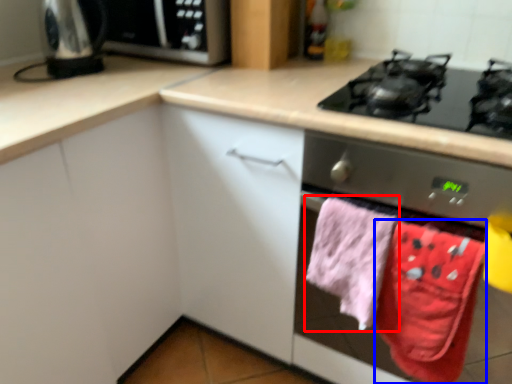
Question: Among these objects, which one is nearest to the camera, beach towel (highlighted by a red box) or beach towel (highlighted by a blue box)?

Choices:
 (A) beach towel
 (B) beach towel

Answer: (B)